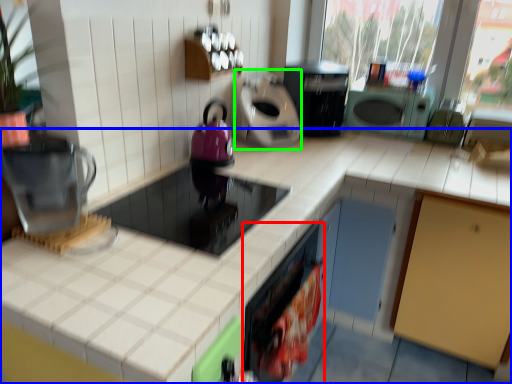
Question: Based on their relative distances, which object is farther from appliance (highlighted by a red box)? Choose from countertop (highlighted by a blue box) and appliance (highlighted by a green box).

Choices:
 (A) countertop
 (B) appliance

Answer: (B)